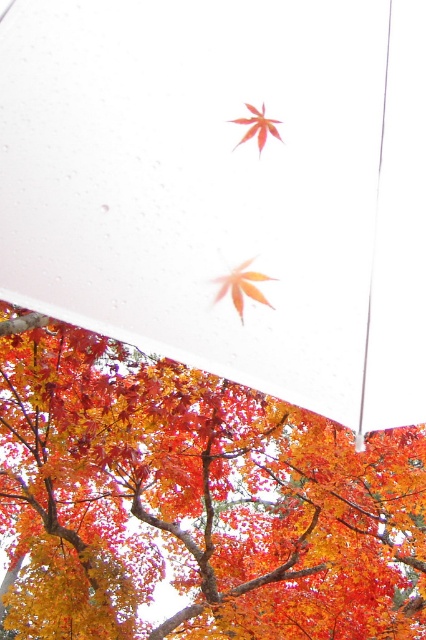
You are an artist trying to paint the scene. You notice the transparent plastic canopy at center and the orange matte maple leaf at center. Which object should you paint first to ensure proper layering?

You should paint the orange matte maple leaf at center first because the transparent plastic canopy at center is in front of it, so the leaf needs to be painted first to allow the canopy to be layered over it properly.

You are an artist sketching the scene. You need to place the orange matte maple leaf at center and the shiny orange maple leaf at upper center in your drawing. According to the scene, which leaf should you draw first if you start from the left side of the page?

The orange matte maple leaf at center should be drawn first because it is positioned to the left of the shiny orange maple leaf at upper center.

You are holding a camera and want to take a photo of the shiny orange maple leaf at upper center. However, the transparent plastic canopy at center is blocking your view. Can you adjust your position to capture the leaf without the canopy in the frame?

The transparent plastic canopy at center is closer to the viewer than the shiny orange maple leaf at upper center. To avoid the canopy blocking the leaf, you can move your camera position so that the canopy is out of the frame, but since the canopy is closer, you might need to angle the camera downward or shift sideways to exclude it while still framing the leaf.